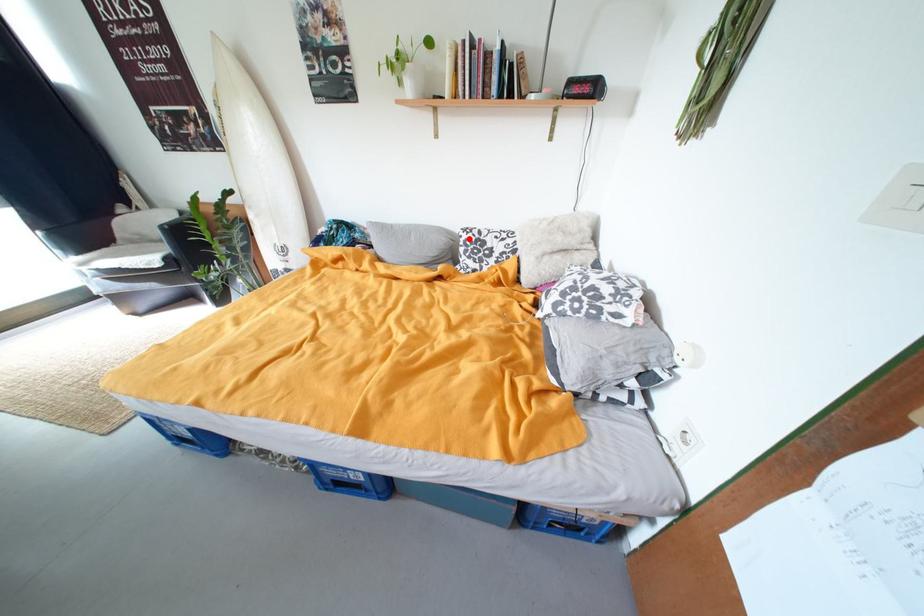
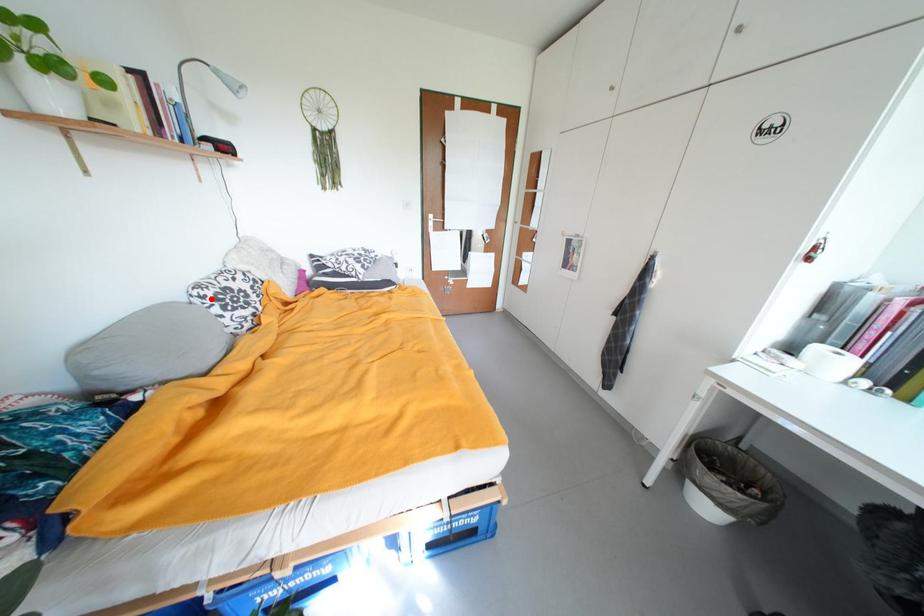
I am providing you with two images of the same scene from different viewpoints. A red point is marked on the first image and another point is marked on the second image. Do the highlighted points in image1 and image2 indicate the same real-world spot?

Yes